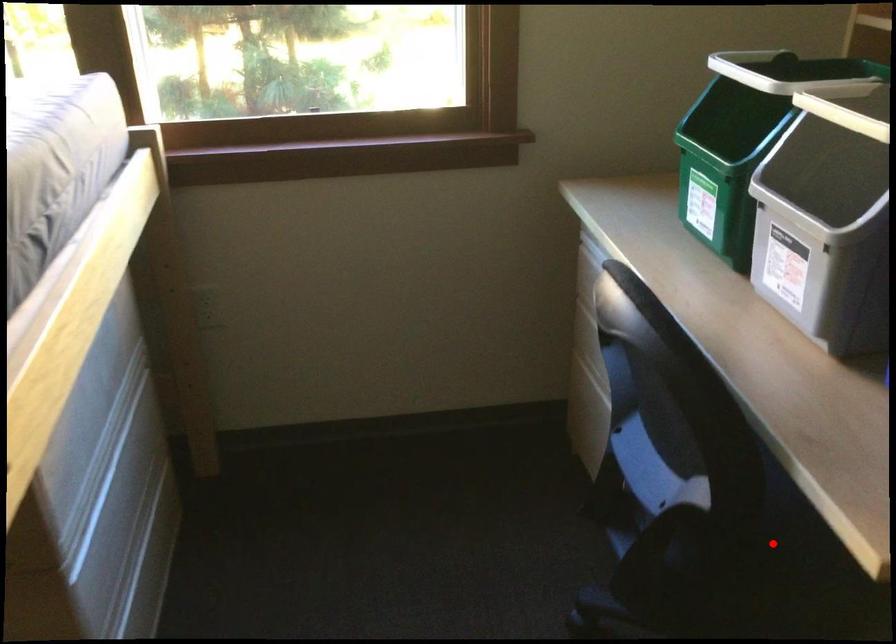
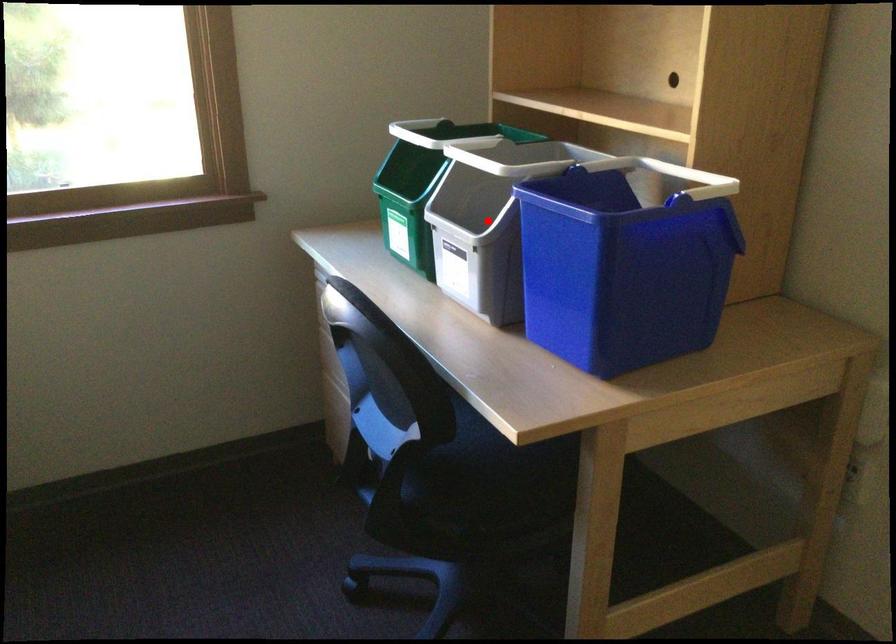
I am providing you with two images of the same scene from different viewpoints. A red point is marked on the first image and another point is marked on the second image. Do the highlighted points in image1 and image2 indicate the same real-world spot?

No